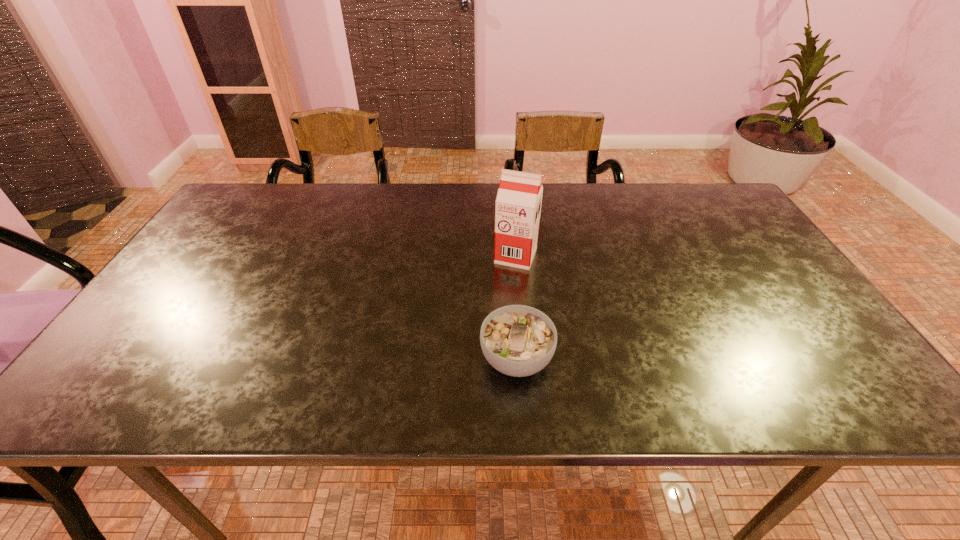
The image size is (960, 540). I want to click on free spot at the far left corner of the desktop, so click(x=262, y=220).

Where is `vacant space at the near left corner`? The image size is (960, 540). vacant space at the near left corner is located at coordinates (121, 409).

In order to click on free space at the far right corner of the desktop in this screenshot , I will do `click(677, 194)`.

The image size is (960, 540). In order to click on free location that satisfies the following two spatial constraints: 1. on the back side of the shorter object; 2. on the left side of the farther object in this screenshot , I will do pyautogui.click(x=509, y=256).

I want to click on vacant point that satisfies the following two spatial constraints: 1. on the back side of the soup bowl; 2. on the right side of the farther object, so click(509, 256).

The image size is (960, 540). I want to click on free space that satisfies the following two spatial constraints: 1. on the back side of the farther object; 2. on the right side of the soup bowl, so click(x=509, y=256).

Where is `free space that satisfies the following two spatial constraints: 1. on the back side of the taller object; 2. on the right side of the soup bowl`? This screenshot has height=540, width=960. free space that satisfies the following two spatial constraints: 1. on the back side of the taller object; 2. on the right side of the soup bowl is located at coordinates (509, 256).